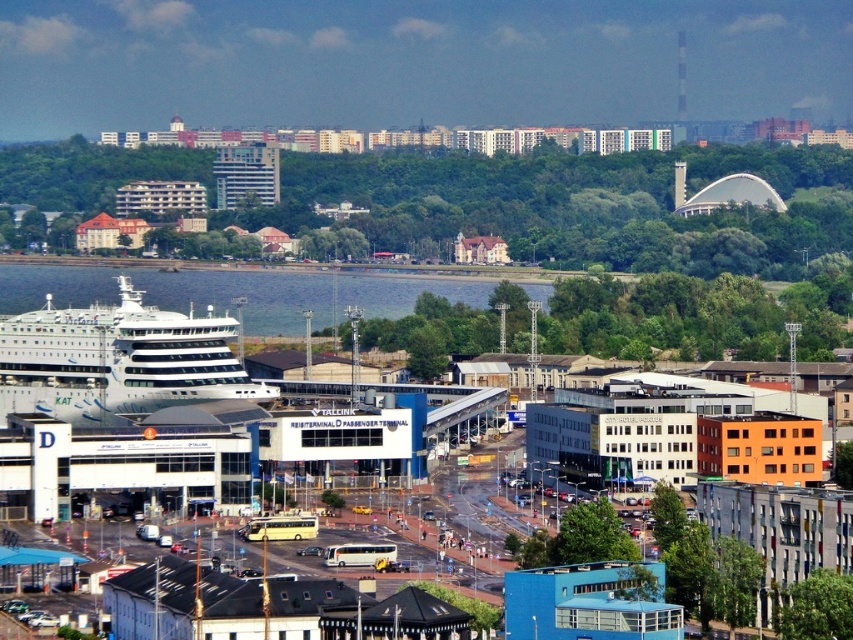
Question: Which of the following is the closest to the observer?

Choices:
 (A) (173, 330)
 (B) (339, 314)

Answer: (B)

Question: Can you confirm if white glossy cruise ship at left is wider than clear blue water at center?

Choices:
 (A) yes
 (B) no

Answer: (B)

Question: Is white glossy cruise ship at left below clear blue water at center?

Choices:
 (A) yes
 (B) no

Answer: (A)

Question: Which point is closer to the camera?

Choices:
 (A) white glossy cruise ship at left
 (B) clear blue water at center

Answer: (B)

Question: Is white glossy cruise ship at left positioned in front of clear blue water at center?

Choices:
 (A) yes
 (B) no

Answer: (B)

Question: Which point is closer to the camera taking this photo?

Choices:
 (A) (236, 323)
 (B) (79, 305)

Answer: (A)